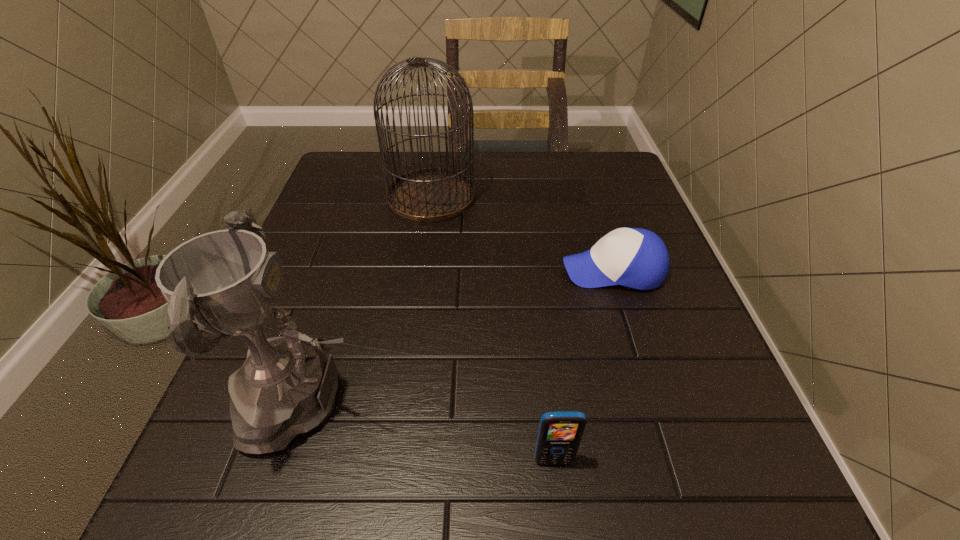
This screenshot has height=540, width=960. In order to click on the farthest object in this screenshot , I will do `click(433, 194)`.

I want to click on award, so click(x=225, y=282).

Identify the location of the third tallest object. This screenshot has height=540, width=960. (559, 435).

Locate an element on the screen. the second object from right to left is located at coordinates (559, 435).

The image size is (960, 540). Identify the location of the rightmost object. (637, 258).

Locate an element on the screen. This screenshot has width=960, height=540. the shortest object is located at coordinates (637, 258).

I want to click on free space located on the right of the farthest object, so click(x=573, y=197).

Image resolution: width=960 pixels, height=540 pixels. In order to click on vacant area located 0.230m on the side with emblem of the award in this screenshot , I will do `click(522, 402)`.

Locate an element on the screen. The width and height of the screenshot is (960, 540). vacant space situated on the screen of the third object from left to right is located at coordinates (560, 512).

Where is `free spot located on the front-facing side of the shortest object`? This screenshot has height=540, width=960. free spot located on the front-facing side of the shortest object is located at coordinates (382, 270).